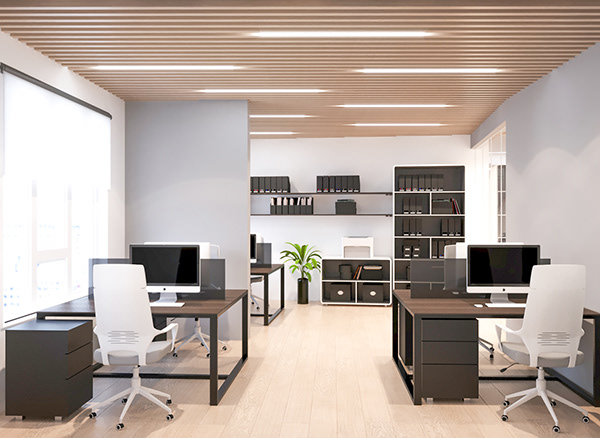
Identify the location of chair. (119, 307), (197, 331), (548, 308), (460, 248), (252, 296).